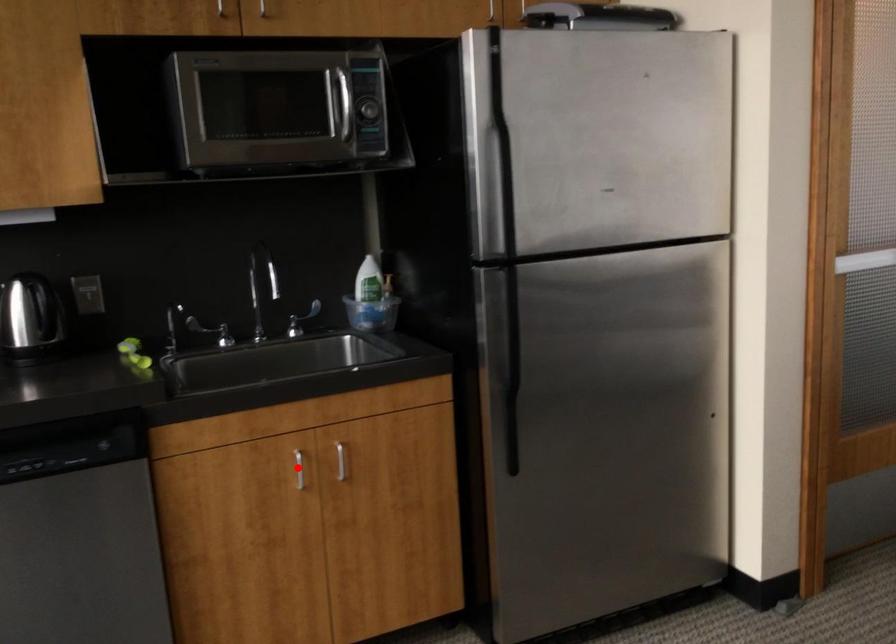
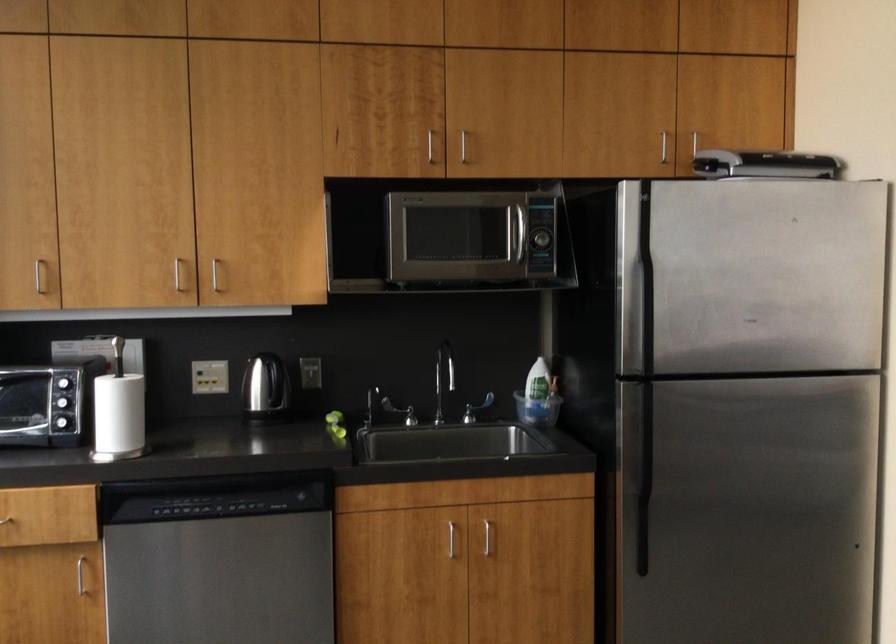
The point at the highlighted location is marked in the first image. Where is the corresponding point in the second image?

(450, 538)